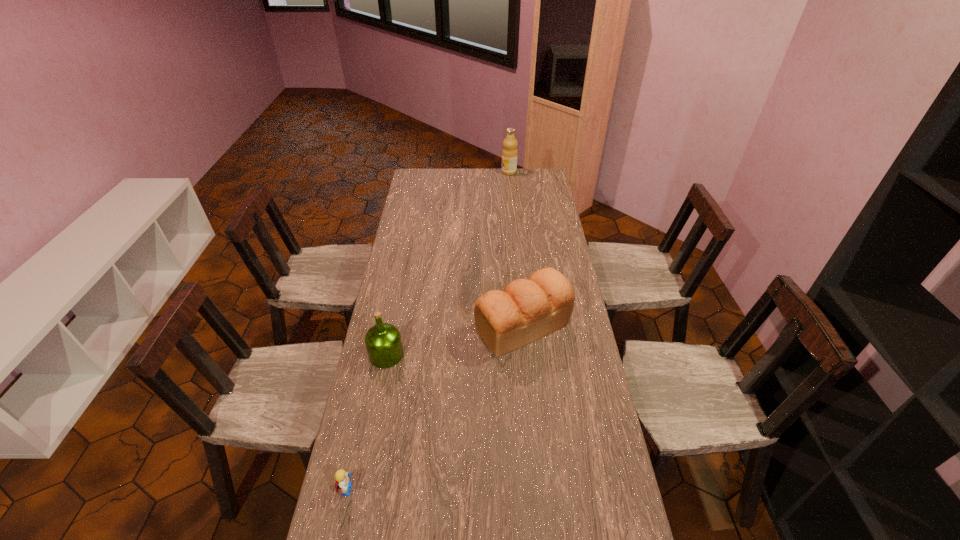
The width and height of the screenshot is (960, 540). I want to click on vacant region located on the front of the bread, so click(x=534, y=447).

In order to click on vacant space located 0.170m on the right of the shorter olive oil in this screenshot , I will do `click(451, 355)`.

At what (x,y) coordinates should I click in order to perform the action: click on vacant point located 0.240m on the front-facing side of the nearest object. Please return your answer as a coordinate pair (x, y). Looking at the image, I should click on (445, 489).

Identify the location of object situated at the far edge. (509, 153).

Locate an element on the screen. The image size is (960, 540). olive oil located in the left edge section of the desktop is located at coordinates tap(383, 342).

Find the location of a particular element. The height and width of the screenshot is (540, 960). Lego present at the left edge is located at coordinates (342, 482).

Find the location of `object present at the right edge`. object present at the right edge is located at coordinates (527, 310).

The width and height of the screenshot is (960, 540). Identify the location of vacant space at the far edge of the desktop. (478, 184).

In order to click on free space at the left edge in this screenshot , I will do `click(401, 226)`.

Where is `vacant space at the right edge`? The width and height of the screenshot is (960, 540). vacant space at the right edge is located at coordinates (601, 498).